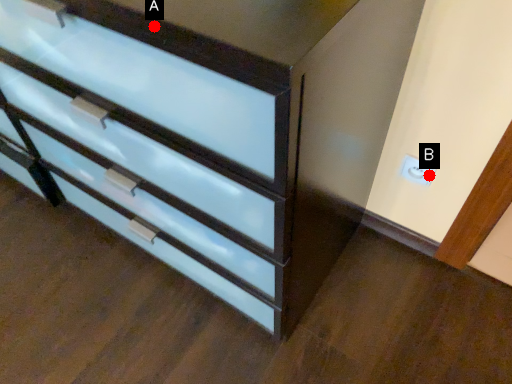
Question: Two points are circled on the image, labeled by A and B beside each circle. Which of the following is the closest to the observer?

Choices:
 (A) A is closer
 (B) B is closer

Answer: (A)